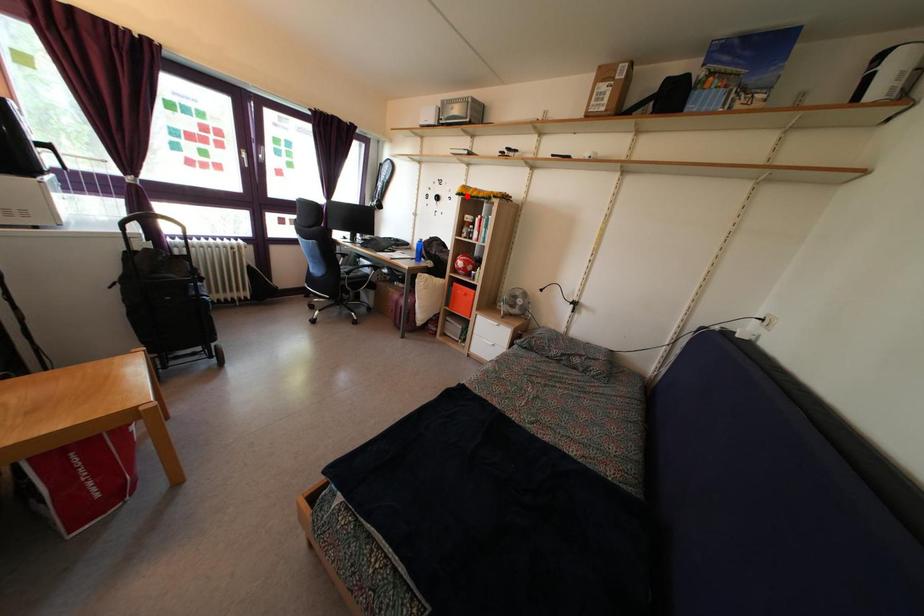
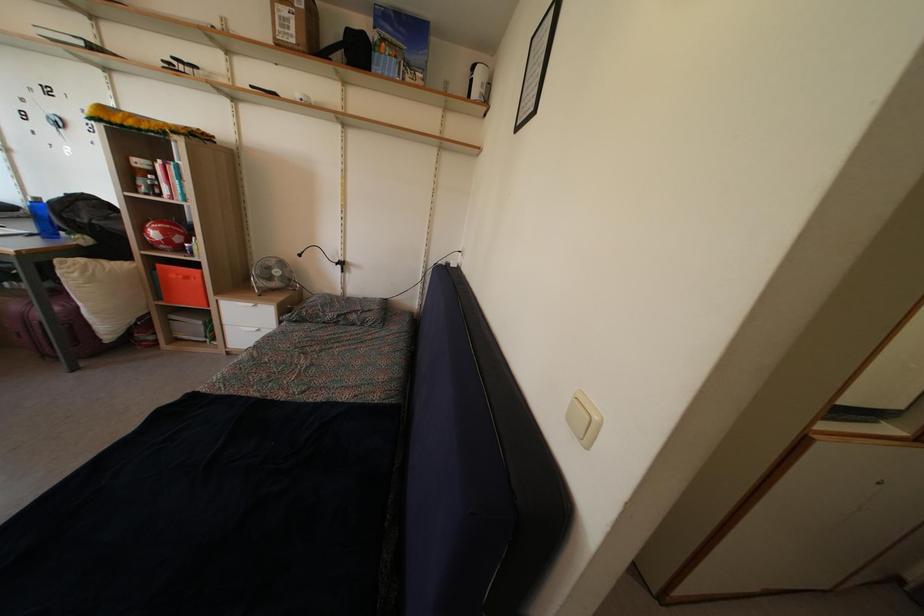
Question: I am providing you with two images of the same scene from different viewpoints. In image1, a red point is highlighted. Considering the same 3D point in image2, which of the following is correct?

Choices:
 (A) It is closer
 (B) It is farther

Answer: (B)